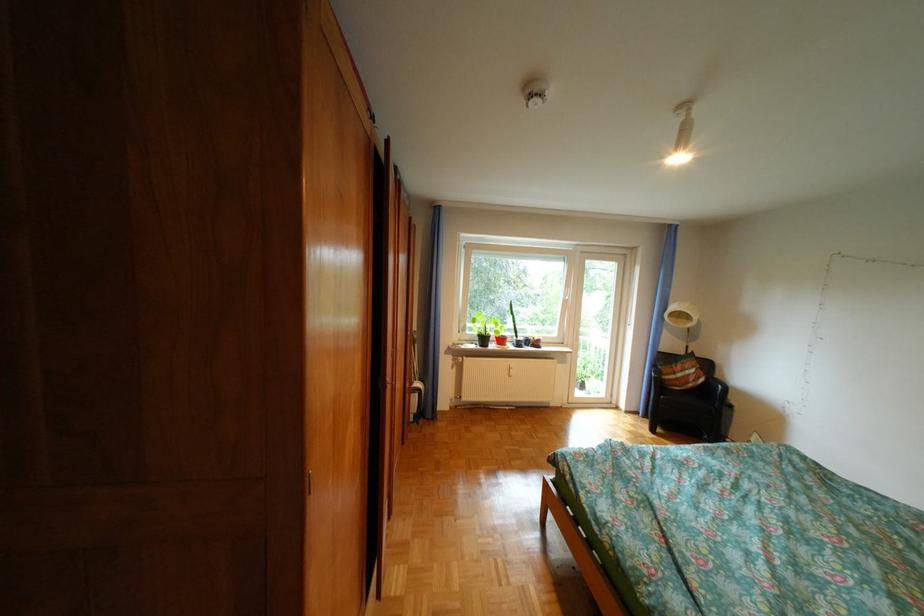
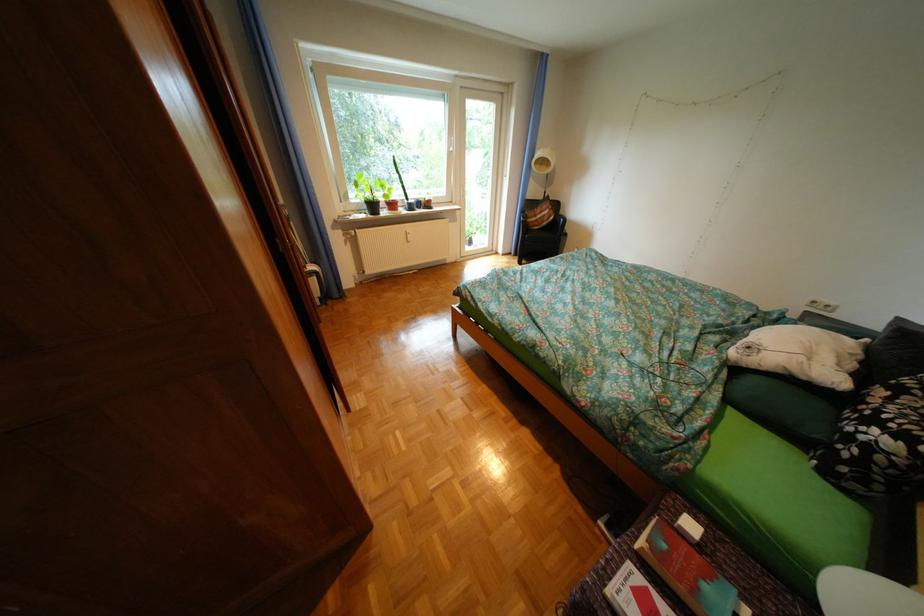
Question: A red point is marked in image1. In image2, is the corresponding 3D point closer to the camera or farther? Reply with the corresponding letter.

Choices:
 (A) The corresponding 3D point is closer.
 (B) The corresponding 3D point is farther.

Answer: (A)